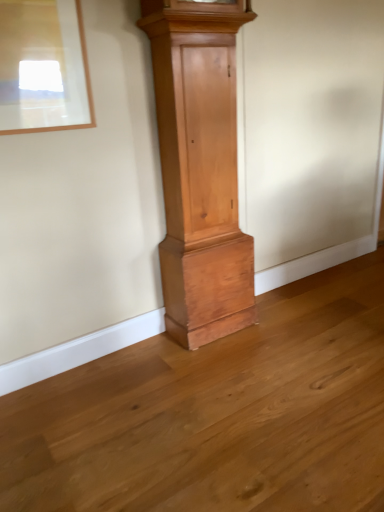
Locate an element on the screen. This screenshot has width=384, height=512. free space in front of natural wood grandfather clock at center is located at coordinates (229, 361).